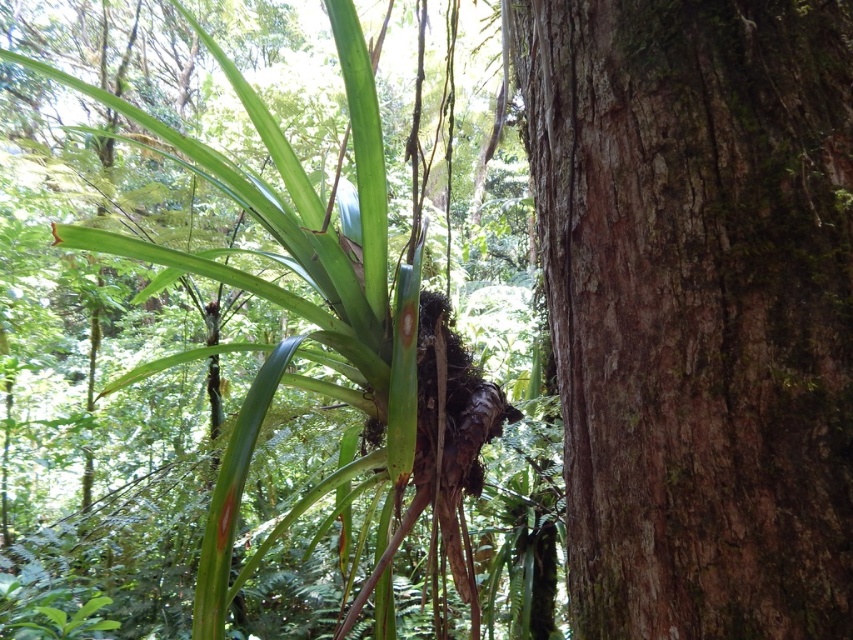
Question: Does brown rough bark at right appear under green rough bark tree at center?

Choices:
 (A) yes
 (B) no

Answer: (B)

Question: Which object is closer to the camera taking this photo?

Choices:
 (A) green rough bark tree at center
 (B) brown rough bark at right

Answer: (A)

Question: Which point is farther to the camera?

Choices:
 (A) brown rough bark at right
 (B) green rough bark tree at center

Answer: (A)

Question: Which of the following is the farthest from the observer?

Choices:
 (A) (784, 352)
 (B) (419, 300)

Answer: (B)

Question: Is brown rough bark at right above green rough bark tree at center?

Choices:
 (A) no
 (B) yes

Answer: (B)

Question: Can you confirm if brown rough bark at right is positioned to the right of green rough bark tree at center?

Choices:
 (A) no
 (B) yes

Answer: (B)